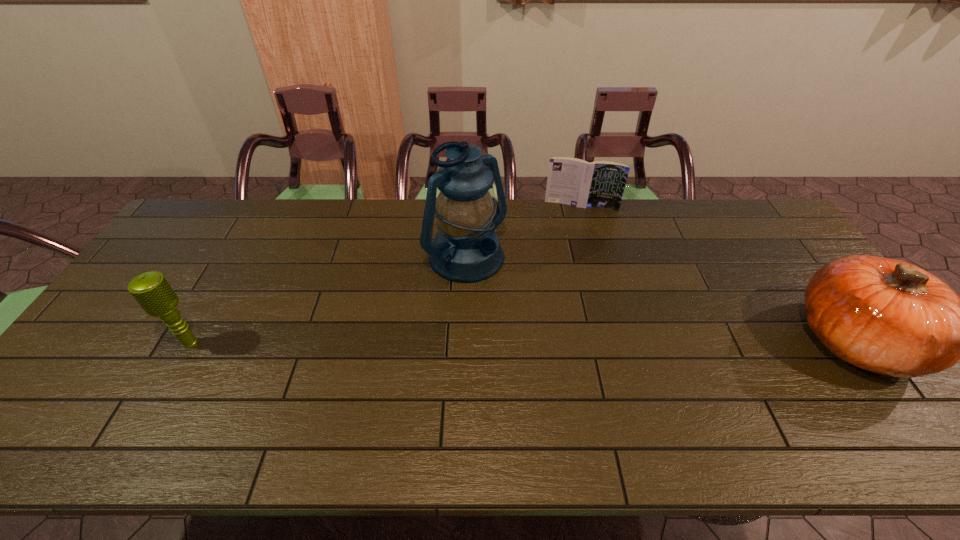
Identify the location of vacant spot on the desktop that is between the microphone and the pumpkin and is positioned on the face of the lantern. (547, 341).

I want to click on vacant space on the desktop that is between the microphone and the rightmost object and is positioned on the front cover of the third object from left to right, so click(567, 341).